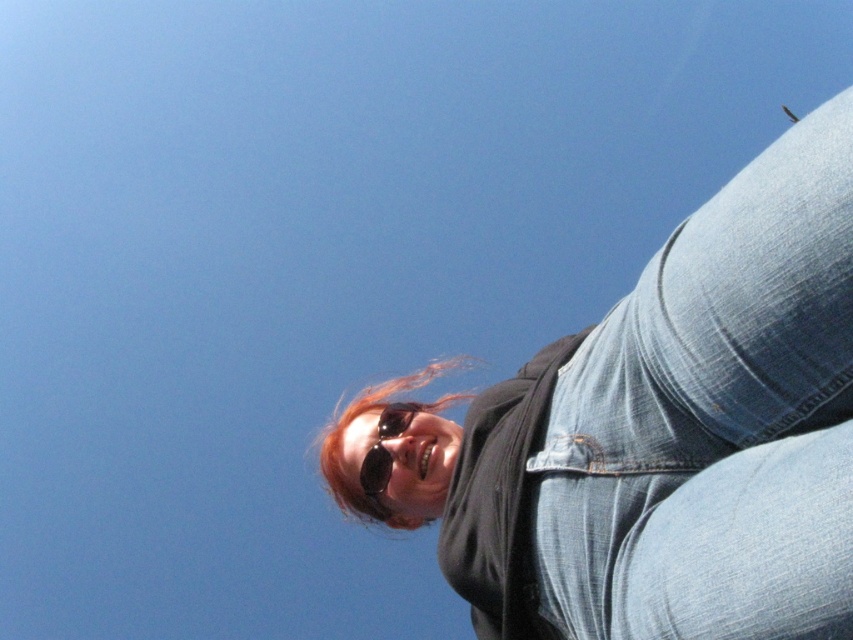
You are taking a photo of a person under a clear blue sky. You notice two points in the image labeled as point (790,218) and point (331,468). Which point is nearer to the camera?

Point (790,218) is closer to the camera than point (331,468).

You are a photographer trying to adjust the lighting for a portrait. You notice the blonde hair at center and the black reflective sunglasses at center. Which object is positioned to the left of the other?

The blonde hair at center is to the left of the black reflective sunglasses at center.